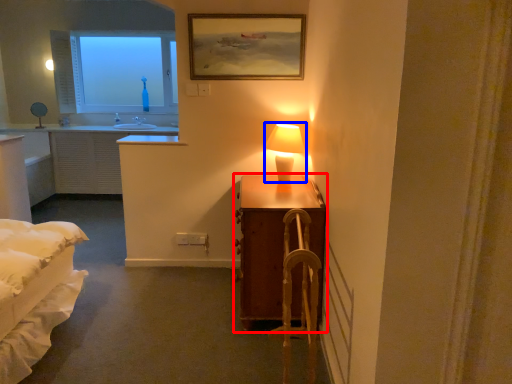
Question: Which object appears closest to the camera in this image, table (highlighted by a red box) or table lamp (highlighted by a blue box)?

Choices:
 (A) table
 (B) table lamp

Answer: (A)